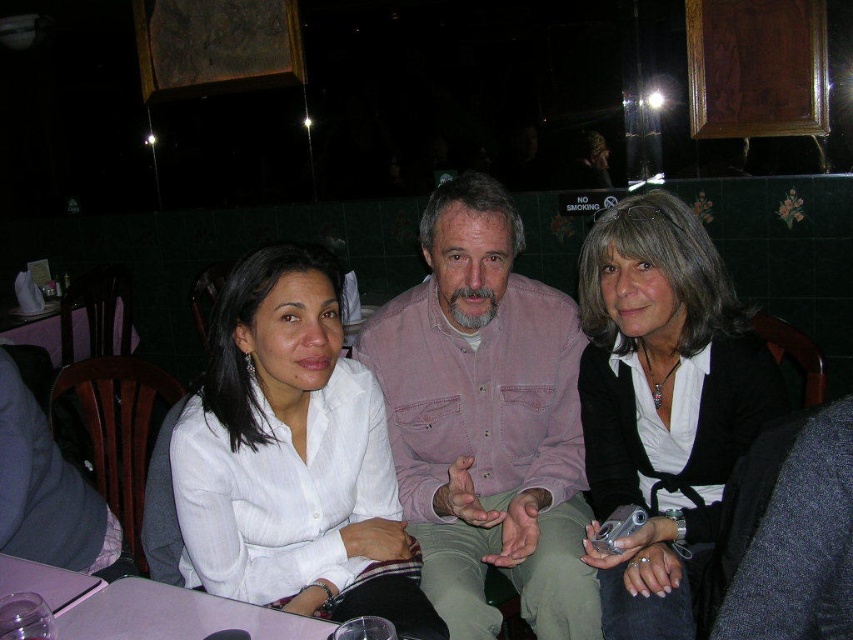
Question: Is white cotton shirt at center to the left of matte black camera at center from the viewer's perspective?

Choices:
 (A) no
 (B) yes

Answer: (B)

Question: Is white cotton shirt at center to the left of matte black camera at center from the viewer's perspective?

Choices:
 (A) yes
 (B) no

Answer: (A)

Question: Is pink cotton shirt at center wider than matte black camera at center?

Choices:
 (A) yes
 (B) no

Answer: (A)

Question: Which point is farther to the camera?

Choices:
 (A) (703, 483)
 (B) (428, 577)
 (C) (283, 524)

Answer: (A)

Question: Which point is farther to the camera?

Choices:
 (A) (596, 515)
 (B) (546, 627)
 (C) (332, 445)

Answer: (A)

Question: Based on their relative distances, which object is farther from the white cotton shirt at center?

Choices:
 (A) matte black camera at center
 (B) pink cotton shirt at center

Answer: (A)